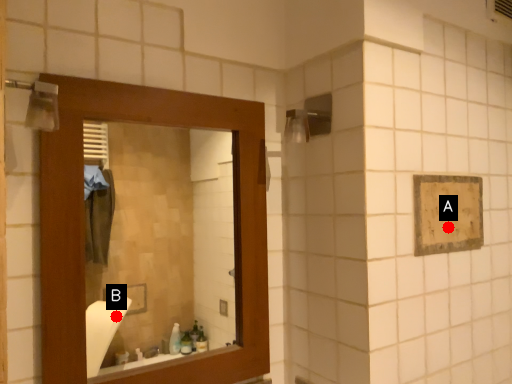
Question: Two points are circled on the image, labeled by A and B beside each circle. Among these points, which one is farthest from the camera?

Choices:
 (A) A is further
 (B) B is further

Answer: (B)